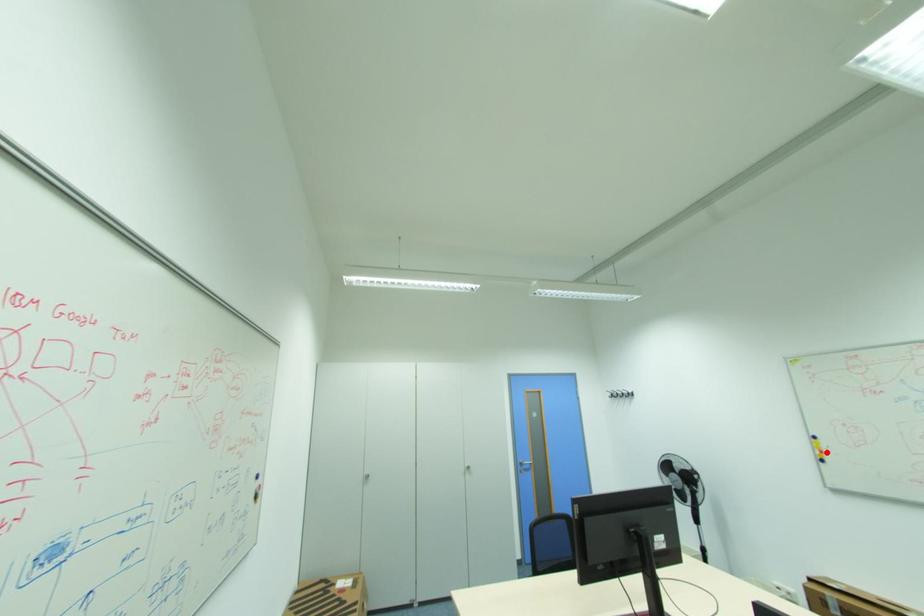
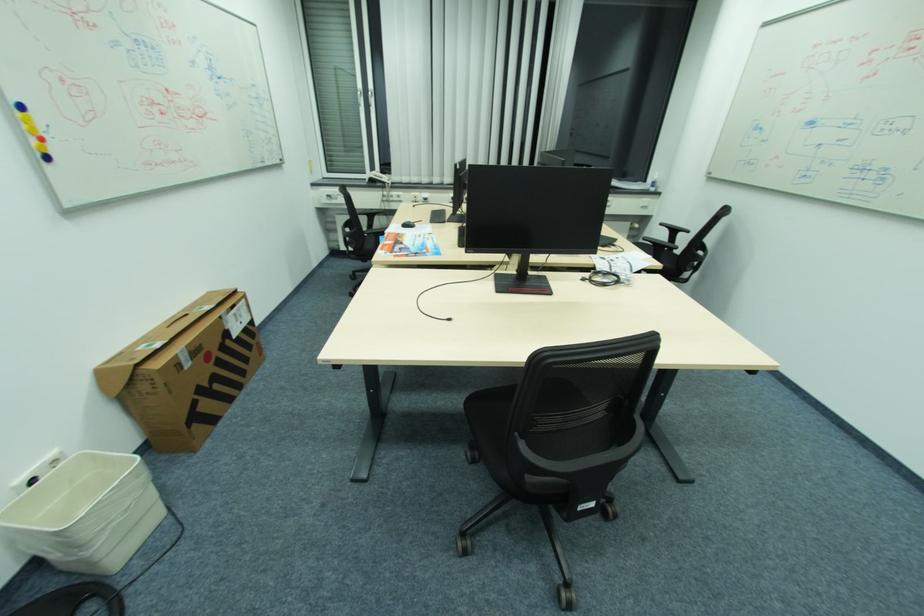
The point at the highlighted location is marked in the first image. Where is the corresponding point in the second image?

(44, 140)